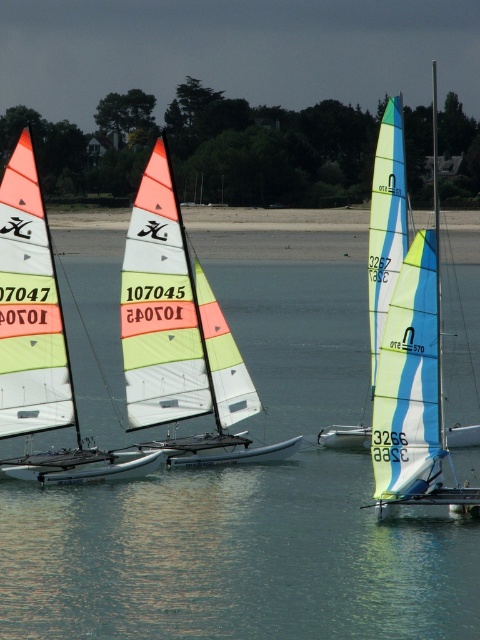
What do you see at coordinates (248, 508) in the screenshot?
I see `transparent water at center` at bounding box center [248, 508].

The width and height of the screenshot is (480, 640). I want to click on transparent water at center, so (x=248, y=508).

Does white glossy sailboat at left have a greater height compared to light blue and white sail at right?

No, white glossy sailboat at left is not taller than light blue and white sail at right.

Find the location of `white glossy sailboat at left`. white glossy sailboat at left is located at coordinates (39, 340).

The image size is (480, 640). Identify the location of white glossy sailboat at left. (39, 340).

Can you confirm if transparent water at center is shorter than white glossy sailboat at left?

No.

Is transparent water at center above white glossy sailboat at left?

Incorrect, transparent water at center is not positioned above white glossy sailboat at left.

Who is more forward, [204,604] or [0,268]?

Positioned in front is point [204,604].

I want to click on transparent water at center, so click(x=248, y=508).